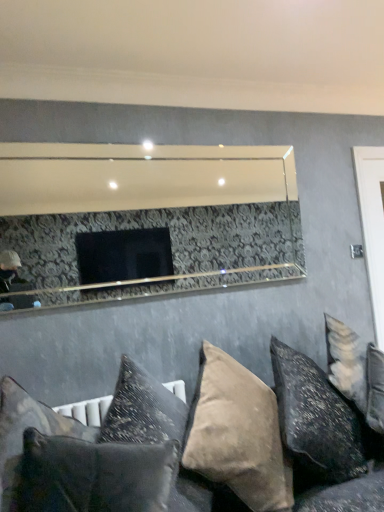
Describe the element at coordinates (143, 409) in the screenshot. The width and height of the screenshot is (384, 512). I see `suede-like beige pillow at lower center, positioned as the 3th pillow in right-to-left order` at that location.

Locate an element on the screen. velvet beige pillow at lower right, arranged as the 5th pillow when viewed from the left is located at coordinates (317, 422).

You are a GUI agent. You are given a task and a screenshot of the screen. Output one action in this format:
    pyautogui.click(x=<x>, y=<y>)
    Task: Click on the velvet cushions at lower center
    The width and height of the screenshot is (384, 512).
    Given the screenshot: What is the action you would take?
    pyautogui.click(x=163, y=450)

In order to face velvet dark gray pillow at lower left, acting as the first pillow starting from the left, should I rotate leftwards or rightwards?

Rotate left and turn 16.505 degrees.

Identify the location of suede-like beige pillow at lower center, which is counted as the third pillow, starting from the left. This screenshot has height=512, width=384. (143, 409).

Between velvet dark gray pillow at lower left, acting as the first pillow starting from the left, and suede-like beige pillow at lower center, which is counted as the 4th pillow, starting from the left, which one is positioned behind?

suede-like beige pillow at lower center, which is counted as the 4th pillow, starting from the left, is further away from the camera.

Is suede-like beige pillow at lower center, which is counted as the 4th pillow, starting from the left, inside velvet dark gray pillow at lower left, the fifth pillow when ordered from right to left?

Actually, suede-like beige pillow at lower center, which is counted as the 4th pillow, starting from the left, is outside velvet dark gray pillow at lower left, the fifth pillow when ordered from right to left.

Looking at this image, from the image's perspective, which object appears higher, velvet dark gray pillow at lower left, acting as the first pillow starting from the left, or suede-like beige pillow at lower center, arranged as the second pillow when viewed from the right?

From the image's view, velvet dark gray pillow at lower left, acting as the first pillow starting from the left, is above.

Can you tell me how much velvet dark gray pillow at lower left, the fifth pillow when ordered from right to left, and suede-like beige pillow at lower center, which is counted as the 4th pillow, starting from the left, differ in facing direction?

The angle between the facing direction of velvet dark gray pillow at lower left, the fifth pillow when ordered from right to left, and the facing direction of suede-like beige pillow at lower center, which is counted as the 4th pillow, starting from the left, is 7.94e-05 degrees.

Could you tell me if velvet cushions at lower center is turned towards suede-like beige pillow at lower center, arranged as the second pillow when viewed from the right?

No.

Consider the image. Which is less distant, (52, 442) or (254, 481)?

Positioned in front is point (52, 442).

Is velvet cushions at lower center in contact with suede-like beige pillow at lower center, arranged as the second pillow when viewed from the right?

No.

Could velvet dark gray pillow at lower left, the fifth pillow when ordered from right to left, be considered to be inside textured gray pillow at lower center, acting as the fourth pillow starting from the right?

Definitely not — velvet dark gray pillow at lower left, the fifth pillow when ordered from right to left, is not inside textured gray pillow at lower center, acting as the fourth pillow starting from the right.

Between textured gray pillow at lower center, acting as the fourth pillow starting from the right, and velvet dark gray pillow at lower left, the fifth pillow when ordered from right to left, which one is positioned behind?

Positioned behind is velvet dark gray pillow at lower left, the fifth pillow when ordered from right to left.

Can you confirm if textured gray pillow at lower center, acting as the fourth pillow starting from the right, is wider than velvet dark gray pillow at lower left, the fifth pillow when ordered from right to left?

Yes.

How far apart are textured gray pillow at lower center, which is the 2th pillow from left to right, and velvet dark gray pillow at lower left, the fifth pillow when ordered from right to left?

textured gray pillow at lower center, which is the 2th pillow from left to right, is 6.31 inches from velvet dark gray pillow at lower left, the fifth pillow when ordered from right to left.

This screenshot has height=512, width=384. Identify the location of pillow lying below the suede-like beige pillow at lower center, which is counted as the third pillow, starting from the left (from the image's perspective). (237, 434).

Is suede-like beige pillow at lower center, arranged as the second pillow when viewed from the right, placed right next to suede-like beige pillow at lower center, positioned as the 3th pillow in right-to-left order?

No.

Considering the relative sizes of suede-like beige pillow at lower center, arranged as the second pillow when viewed from the right, and suede-like beige pillow at lower center, positioned as the 3th pillow in right-to-left order, in the image provided, is suede-like beige pillow at lower center, arranged as the second pillow when viewed from the right, thinner than suede-like beige pillow at lower center, positioned as the 3th pillow in right-to-left order,?

Incorrect, the width of suede-like beige pillow at lower center, arranged as the second pillow when viewed from the right, is not less than that of suede-like beige pillow at lower center, positioned as the 3th pillow in right-to-left order.

From a real-world perspective, is suede-like beige pillow at lower center, which is counted as the 4th pillow, starting from the left, located higher than suede-like beige pillow at lower center, which is counted as the third pillow, starting from the left?

No.

Can we say velvet beige pillow at lower right, acting as the first pillow starting from the right, lies outside suede-like beige pillow at lower center, positioned as the 3th pillow in right-to-left order?

Absolutely, velvet beige pillow at lower right, acting as the first pillow starting from the right, is external to suede-like beige pillow at lower center, positioned as the 3th pillow in right-to-left order.

Is velvet beige pillow at lower right, arranged as the 5th pillow when viewed from the left, to the right of suede-like beige pillow at lower center, which is counted as the third pillow, starting from the left, from the viewer's perspective?

Yes, velvet beige pillow at lower right, arranged as the 5th pillow when viewed from the left, is to the right of suede-like beige pillow at lower center, which is counted as the third pillow, starting from the left.

Which of these two, velvet beige pillow at lower right, arranged as the 5th pillow when viewed from the left, or suede-like beige pillow at lower center, which is counted as the third pillow, starting from the left, is thinner?

Thinner between the two is suede-like beige pillow at lower center, which is counted as the third pillow, starting from the left.

Does velvet beige pillow at lower right, acting as the first pillow starting from the right, have a greater height compared to suede-like beige pillow at lower center, positioned as the 3th pillow in right-to-left order?

Result: Incorrect, the height of velvet beige pillow at lower right, acting as the first pillow starting from the right, is not larger of that of suede-like beige pillow at lower center, positioned as the 3th pillow in right-to-left order.

From a real-world perspective, is textured gray pillow at lower center, which is the 2th pillow from left to right, positioned above or below velvet cushions at lower center?

textured gray pillow at lower center, which is the 2th pillow from left to right, is above velvet cushions at lower center.

I want to click on studio couch in front of the textured gray pillow at lower center, acting as the fourth pillow starting from the right, so click(x=163, y=450).

Considering the relative sizes of textured gray pillow at lower center, which is the 2th pillow from left to right, and velvet cushions at lower center in the image provided, is textured gray pillow at lower center, which is the 2th pillow from left to right, shorter than velvet cushions at lower center?

Yes, textured gray pillow at lower center, which is the 2th pillow from left to right, is shorter than velvet cushions at lower center.

Is textured gray pillow at lower center, acting as the fourth pillow starting from the right, oriented towards velvet cushions at lower center?

Yes, textured gray pillow at lower center, acting as the fourth pillow starting from the right, faces towards velvet cushions at lower center.

From the image's perspective, between velvet cushions at lower center and velvet beige pillow at lower right, arranged as the 5th pillow when viewed from the left, who is located below?

velvet cushions at lower center.

Measure the distance between velvet cushions at lower center and velvet beige pillow at lower right, acting as the first pillow starting from the right.

A distance of 7.02 inches exists between velvet cushions at lower center and velvet beige pillow at lower right, acting as the first pillow starting from the right.

Which of these two, velvet cushions at lower center or velvet beige pillow at lower right, acting as the first pillow starting from the right, is smaller?

Smaller between the two is velvet beige pillow at lower right, acting as the first pillow starting from the right.

I want to click on studio couch on the left of velvet beige pillow at lower right, arranged as the 5th pillow when viewed from the left, so click(x=163, y=450).

The width and height of the screenshot is (384, 512). In order to click on pillow that is the 3rd object located above the suede-like beige pillow at lower center, which is counted as the 4th pillow, starting from the left (from the image's perspective) in this screenshot , I will do `click(23, 432)`.

At what (x,y) coordinates should I click in order to perform the action: click on studio couch in front of the suede-like beige pillow at lower center, which is counted as the 4th pillow, starting from the left. Please return your answer as a coordinate pair (x, y). Looking at the image, I should click on (163, 450).

Based on their spatial positions, is textured gray pillow at lower center, which is the 2th pillow from left to right, or suede-like beige pillow at lower center, which is counted as the 4th pillow, starting from the left, closer to suede-like beige pillow at lower center, which is counted as the third pillow, starting from the left?

suede-like beige pillow at lower center, which is counted as the 4th pillow, starting from the left.

Estimate the real-world distances between objects in this image. Which object is closer to suede-like beige pillow at lower center, arranged as the second pillow when viewed from the right, clear glass mirror at upper center or velvet dark gray pillow at lower left, the fifth pillow when ordered from right to left?

Among the two, velvet dark gray pillow at lower left, the fifth pillow when ordered from right to left, is located nearer to suede-like beige pillow at lower center, arranged as the second pillow when viewed from the right.

Estimate the real-world distances between objects in this image. Which object is closer to white glossy door at right, suede-like beige pillow at lower center, positioned as the 3th pillow in right-to-left order, or velvet cushions at lower center?

velvet cushions at lower center is positioned closer to the anchor white glossy door at right.

Looking at the image, which one is located further to suede-like beige pillow at lower center, positioned as the 3th pillow in right-to-left order, velvet beige pillow at lower right, arranged as the 5th pillow when viewed from the left, or velvet cushions at lower center?

velvet beige pillow at lower right, arranged as the 5th pillow when viewed from the left, is positioned further to the anchor suede-like beige pillow at lower center, positioned as the 3th pillow in right-to-left order.

Estimate the real-world distances between objects in this image. Which object is further from white glossy door at right, velvet cushions at lower center or suede-like beige pillow at lower center, which is counted as the 4th pillow, starting from the left?

Based on the image, suede-like beige pillow at lower center, which is counted as the 4th pillow, starting from the left, appears to be further to white glossy door at right.

Looking at the image, which one is located further to suede-like beige pillow at lower center, which is counted as the 4th pillow, starting from the left, textured gray pillow at lower center, acting as the fourth pillow starting from the right, or clear glass mirror at upper center?

Among the two, clear glass mirror at upper center is located further to suede-like beige pillow at lower center, which is counted as the 4th pillow, starting from the left.

Looking at this image, from the image, which object appears to be farther from suede-like beige pillow at lower center, positioned as the 3th pillow in right-to-left order, velvet cushions at lower center or velvet beige pillow at lower right, acting as the first pillow starting from the right?

velvet beige pillow at lower right, acting as the first pillow starting from the right, is positioned further to the anchor suede-like beige pillow at lower center, positioned as the 3th pillow in right-to-left order.

From the image, which object appears to be nearer to suede-like beige pillow at lower center, which is counted as the third pillow, starting from the left, velvet cushions at lower center or velvet dark gray pillow at lower left, acting as the first pillow starting from the left?

velvet cushions at lower center.

Where is `mirror positioned between textured gray pillow at lower center, which is the 2th pillow from left to right, and white glossy door at right from near to far`? The height and width of the screenshot is (512, 384). mirror positioned between textured gray pillow at lower center, which is the 2th pillow from left to right, and white glossy door at right from near to far is located at coordinates (147, 218).

Where is `mirror between suede-like beige pillow at lower center, positioned as the 3th pillow in right-to-left order, and white glossy door at right from left to right`? This screenshot has height=512, width=384. mirror between suede-like beige pillow at lower center, positioned as the 3th pillow in right-to-left order, and white glossy door at right from left to right is located at coordinates (147, 218).

Locate an element on the screen. The width and height of the screenshot is (384, 512). mirror between velvet dark gray pillow at lower left, the fifth pillow when ordered from right to left, and velvet beige pillow at lower right, acting as the first pillow starting from the right, from left to right is located at coordinates (147, 218).

Locate an element on the screen. pillow between suede-like beige pillow at lower center, which is counted as the 4th pillow, starting from the left, and white glossy door at right from front to back is located at coordinates click(x=317, y=422).